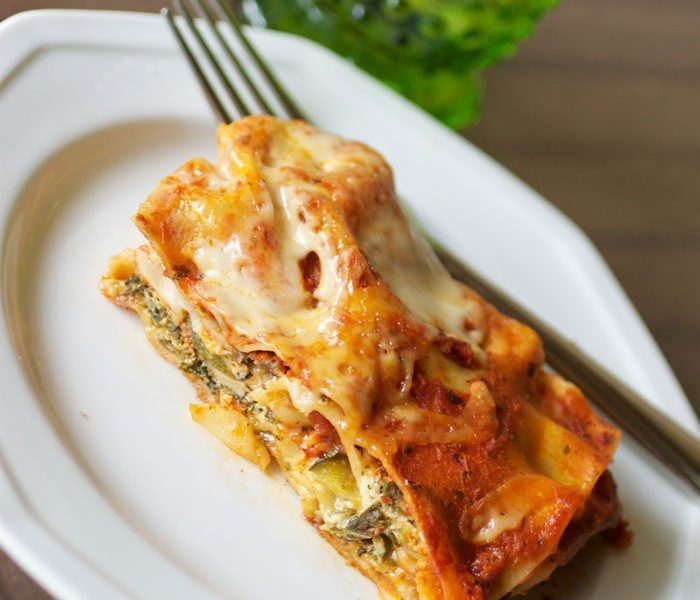
Image resolution: width=700 pixels, height=600 pixels. Identify the location of wooden table. (650, 151).